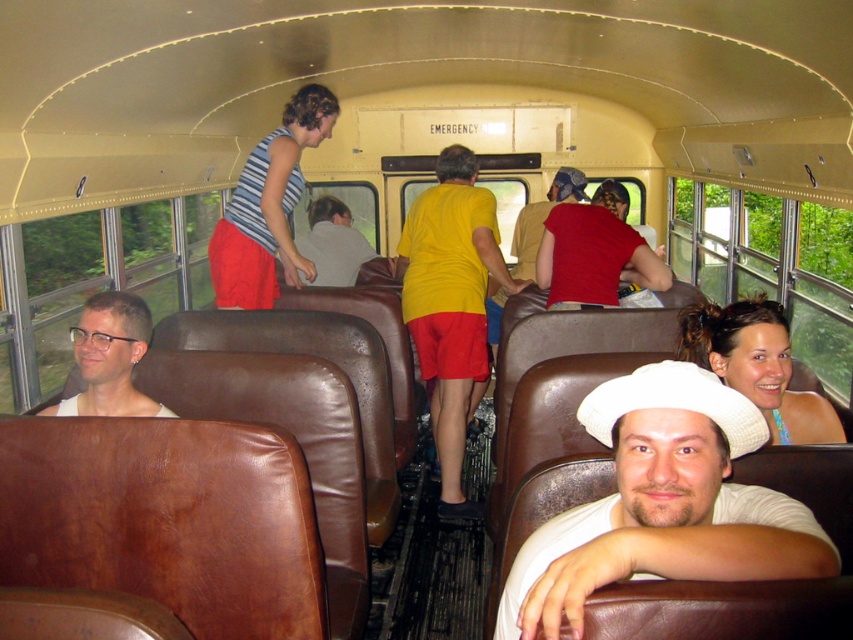
Question: Can you confirm if white matte hat at center is thinner than striped tank top at upper center?

Choices:
 (A) yes
 (B) no

Answer: (A)

Question: Is white matte hat at center to the right of matte red shirt at center from the viewer's perspective?

Choices:
 (A) no
 (B) yes

Answer: (A)

Question: Based on their relative distances, which object is nearer to the white cotton hat at lower right?

Choices:
 (A) matte white shirt at left
 (B) striped tank top at upper center
 (C) white matte hat at center

Answer: (C)

Question: Which object is closer to the camera taking this photo?

Choices:
 (A) white cotton hat at lower right
 (B) light gray fabric shirt at center

Answer: (A)

Question: Among these points, which one is farthest from the camera?

Choices:
 (A) (148, 316)
 (B) (334, 241)
 (C) (288, 209)
 (D) (769, 420)

Answer: (B)

Question: Does yellow matte shirt at center have a smaller size compared to striped tank top at upper center?

Choices:
 (A) no
 (B) yes

Answer: (A)